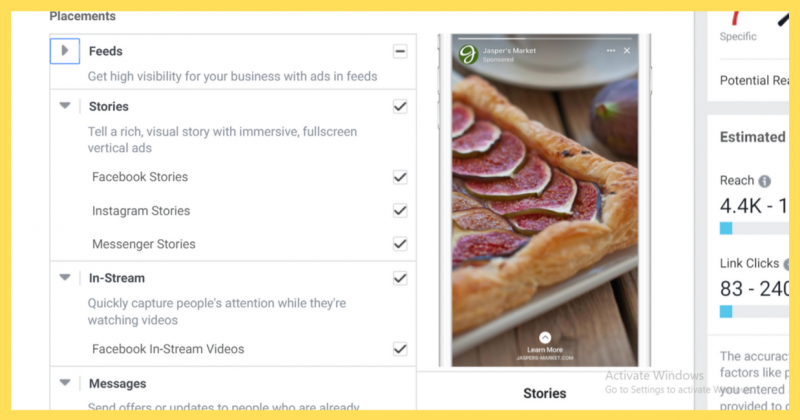
Locate an element on the screen. Image resolution: width=800 pixels, height=420 pixels. grey divider is located at coordinates (692, 123), (698, 341).